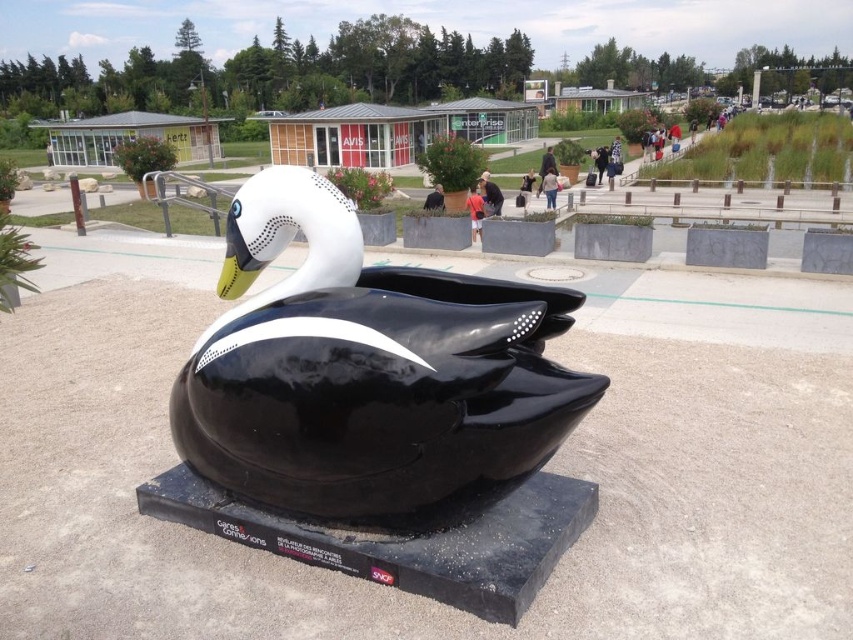
In the scene shown: Is black matte jacket at center to the right of black fabric jacket at center from the viewer's perspective?

Indeed, black matte jacket at center is positioned on the right side of black fabric jacket at center.

Between point (480, 173) and point (431, 196), which one is positioned in front?

Point (431, 196) is more forward.

Identify the location of black matte jacket at center. (490, 195).

What do you see at coordinates (474, 211) in the screenshot? I see `matte black jacket at center` at bounding box center [474, 211].

Between matte black jacket at center and black fabric jacket at center, which one has less height?

With less height is matte black jacket at center.

Image resolution: width=853 pixels, height=640 pixels. What do you see at coordinates (474, 211) in the screenshot?
I see `matte black jacket at center` at bounding box center [474, 211].

This screenshot has width=853, height=640. I want to click on matte black jacket at center, so click(x=474, y=211).

From the picture: Does light beige sweater at center have a lesser height compared to black fabric jacket at center?

No, light beige sweater at center is not shorter than black fabric jacket at center.

Between light beige sweater at center and black fabric jacket at center, which one has more height?

Standing taller between the two is light beige sweater at center.

Find the location of a particular element. This screenshot has height=640, width=853. light beige sweater at center is located at coordinates (549, 188).